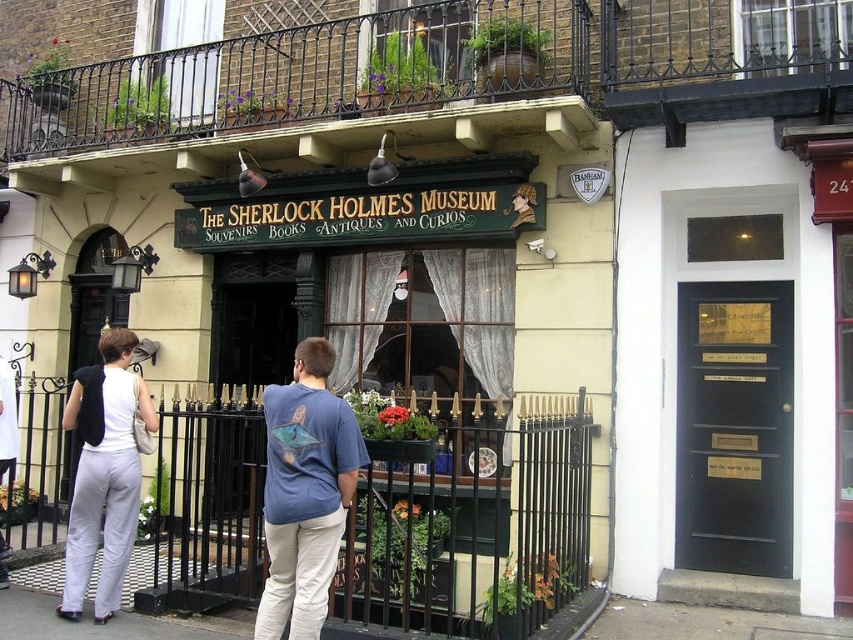
Looking at this image, you are standing at the entrance of The Sherlock Holmes Museum and see two points marked on the building facade. The first point is at coordinates point [688,330] and the second is at point [325,529]. Which point is closer to the entrance?

Point [325,529] is closer to the entrance because it is in front of point [688,330].

You are standing in front of the Sherlock Holmes Museum and see the white cotton pants at center. Where exactly are they located in the image?

The white cotton pants at center are located at the 2D coordinates point [305,492] in the image.